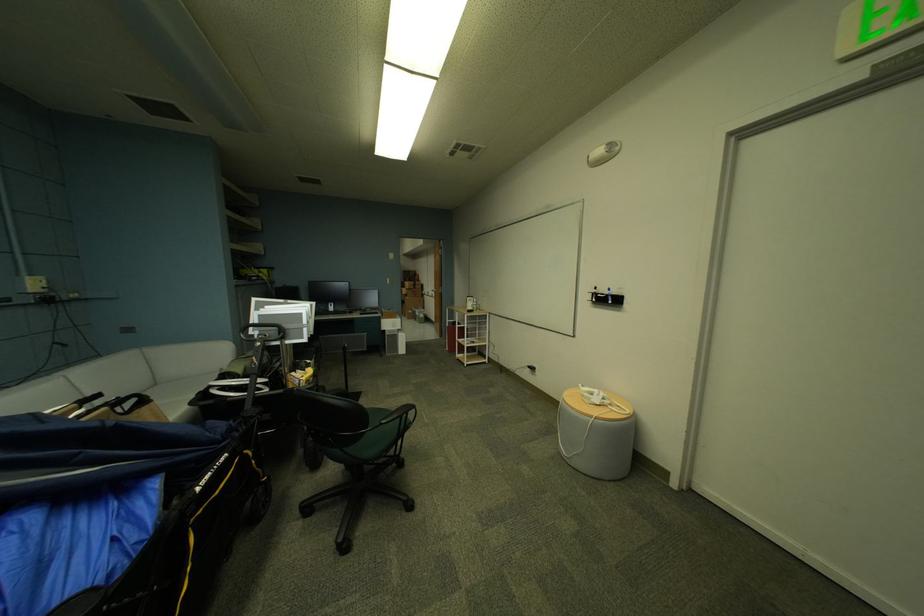
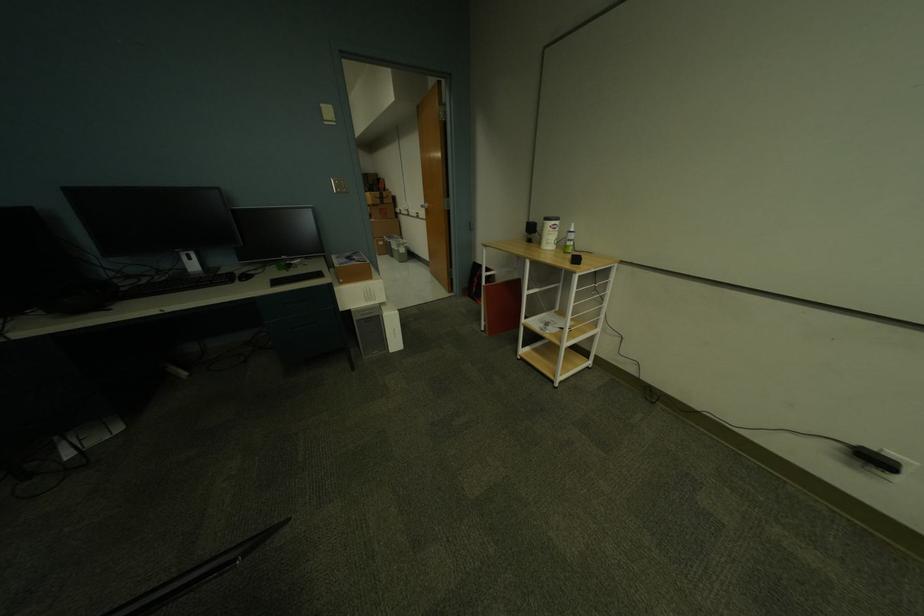
The point at (398, 254) is marked in the first image. Where is the corresponding point in the second image?

(331, 107)